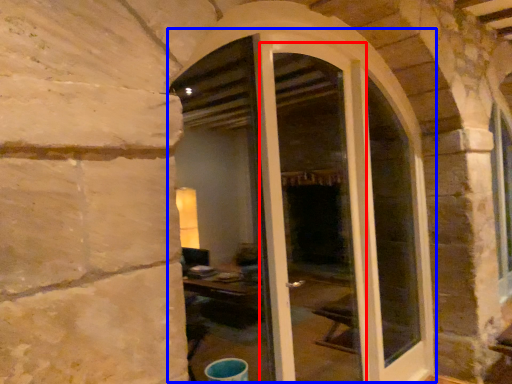
Question: Which object appears farthest to the camera in this image, screen door (highlighted by a red box) or door (highlighted by a blue box)?

Choices:
 (A) screen door
 (B) door

Answer: (A)